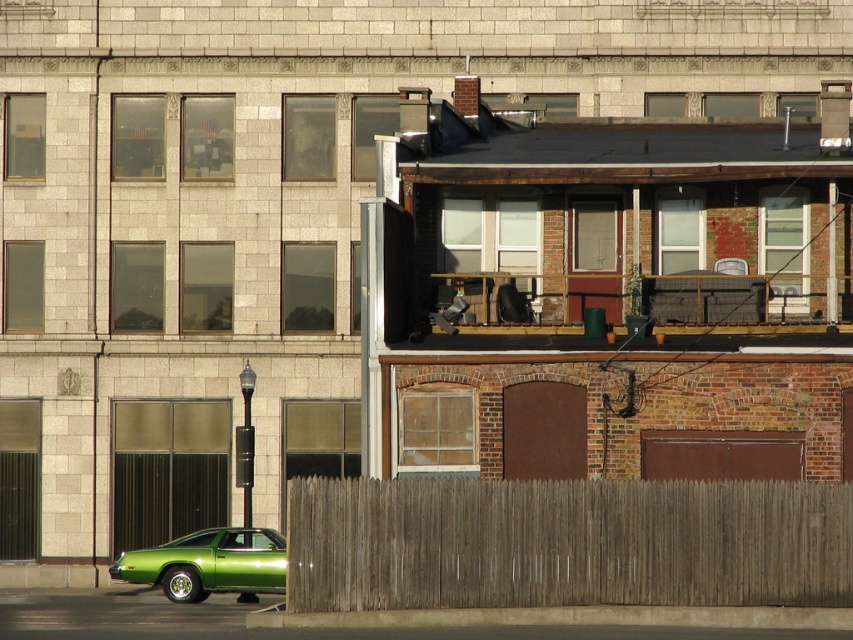
Consider the image. Who is higher up, brown wooden fence at lower center or green glossy car at lower left?

brown wooden fence at lower center

Does brown wooden fence at lower center have a greater width compared to green glossy car at lower left?

Yes.

Does point (318, 547) come behind point (201, 588)?

No, it is not.

Identify the location of brown wooden fence at lower center. (566, 544).